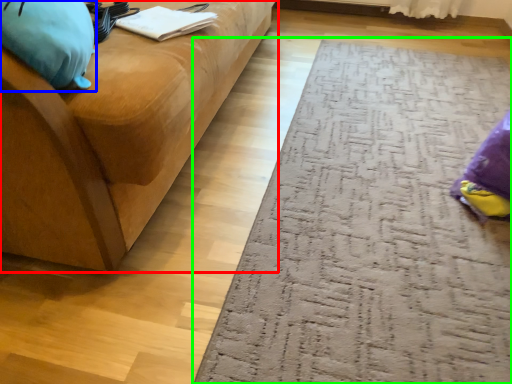
Question: Which object is the closest to the studio couch (highlighted by a red box)? Choose among these: bean bag chair (highlighted by a blue box) or doormat (highlighted by a green box).

Choices:
 (A) bean bag chair
 (B) doormat

Answer: (A)